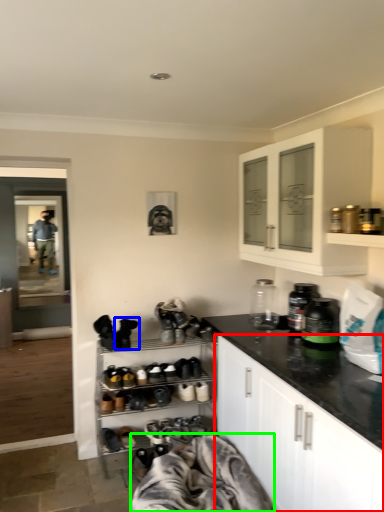
Question: Which object is positioned farthest from cabinetry (highlighted by a red box)? Select from footwear (highlighted by a blue box) and blanket (highlighted by a green box).

Choices:
 (A) footwear
 (B) blanket

Answer: (A)